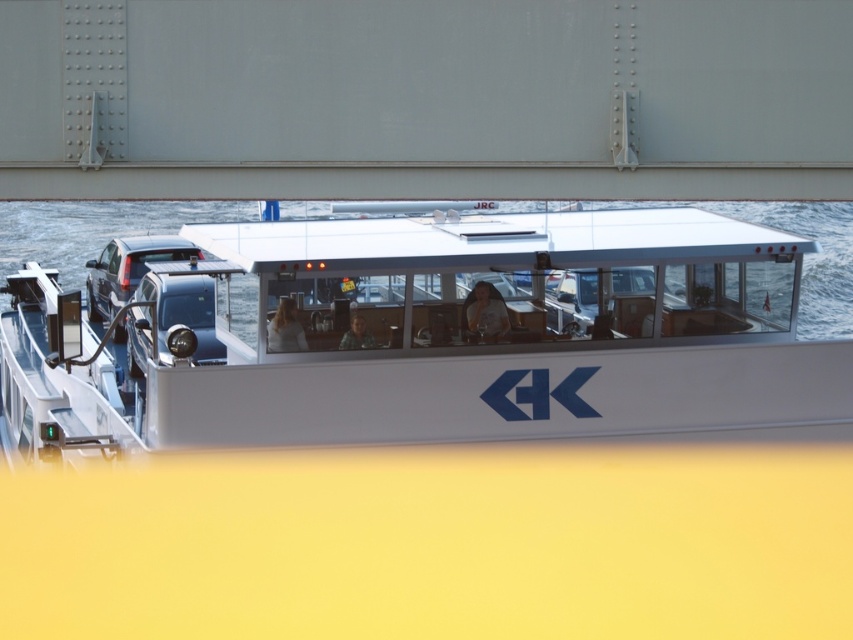
Question: Considering the real-world distances, which object is farthest from the smooth skin face at center?

Choices:
 (A) white glossy boat at center
 (B) clear water at center
 (C) smooth brown hair at center

Answer: (B)

Question: Estimate the real-world distances between objects in this image. Which object is farther from the light brown hair at center?

Choices:
 (A) white glossy boat at center
 (B) smooth brown hair at center
 (C) clear water at center
 (D) smooth skin face at center

Answer: (C)

Question: Can you confirm if clear water at center is bigger than smooth skin face at center?

Choices:
 (A) yes
 (B) no

Answer: (A)

Question: Can you confirm if clear water at center is positioned above smooth brown hair at center?

Choices:
 (A) no
 (B) yes

Answer: (B)

Question: Where is white glossy boat at center located in relation to smooth skin face at center in the image?

Choices:
 (A) right
 (B) left

Answer: (A)

Question: Which of the following is the farthest from the observer?

Choices:
 (A) smooth skin face at center
 (B) smooth brown hair at center
 (C) light brown hair at center

Answer: (B)